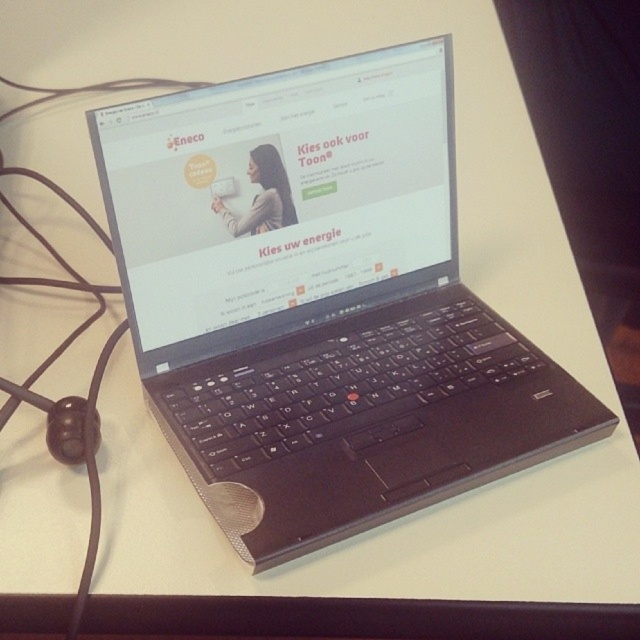
Question: Does matte plastic woman at center appear under white matte text at center?

Choices:
 (A) yes
 (B) no

Answer: (B)

Question: Among these objects, which one is farthest from the camera?

Choices:
 (A) matte plastic woman at center
 (B) white matte text at center

Answer: (B)

Question: Which is nearer to the matte plastic woman at center?

Choices:
 (A) black plastic laptop at center
 (B) white matte text at center

Answer: (B)

Question: Can you confirm if black plastic laptop at center is positioned to the right of white matte text at center?

Choices:
 (A) yes
 (B) no

Answer: (A)

Question: Considering the relative positions of black plastic laptop at center and white matte text at center in the image provided, where is black plastic laptop at center located with respect to white matte text at center?

Choices:
 (A) below
 (B) above

Answer: (A)

Question: Which of the following is the farthest from the observer?

Choices:
 (A) [x=285, y=188]
 (B) [x=307, y=240]

Answer: (B)